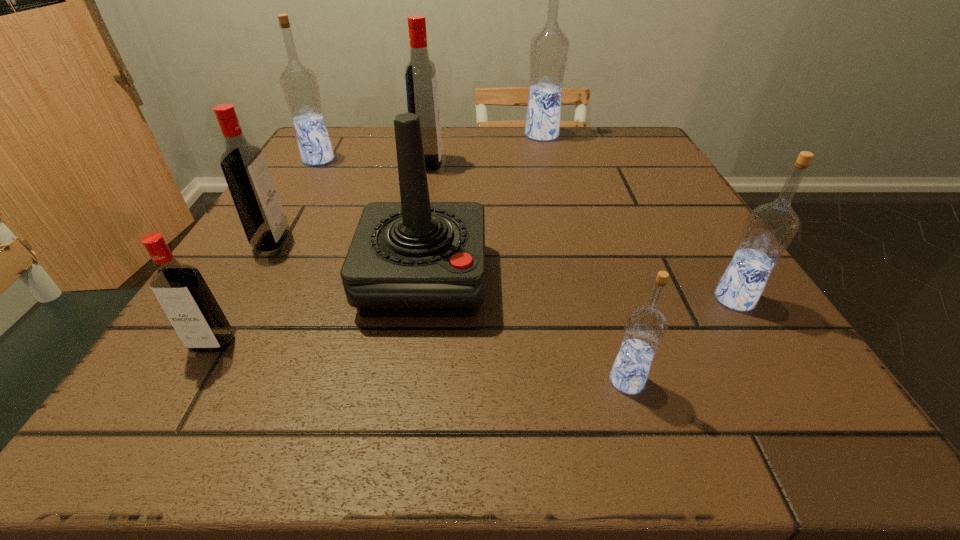
At what (x,y) coordinates should I click in order to perform the action: click on blue vodka object that ranks as the second closest to the nearest red vodka. Please return your answer as a coordinate pair (x, y). Image resolution: width=960 pixels, height=540 pixels. Looking at the image, I should click on (645, 327).

Choose which red vodka is the nearest neighbor to the smallest red vodka. Please provide its 2D coordinates. Your answer should be formatted as a tuple, i.e. [(x, y)], where the tuple contains the x and y coordinates of a point satisfying the conditions above.

[(257, 202)]

Image resolution: width=960 pixels, height=540 pixels. Find the location of `red vodka that is the second nearest to the second nearest vodka`. red vodka that is the second nearest to the second nearest vodka is located at coordinates [x=420, y=74].

You are a GUI agent. You are given a task and a screenshot of the screen. Output one action in this format:
    pyautogui.click(x=<x>, y=<y>)
    Task: Click on the free spot that satisfies the following two spatial constraints: 1. on the front and back of the fourth farthest vodka; 2. on the right side of the third nearest vodka
    The image size is (960, 540).
    Given the screenshot: What is the action you would take?
    pyautogui.click(x=237, y=299)

Where is `free location that satisfies the following two spatial constraints: 1. on the front and back of the nearest blue vodka; 2. on the left side of the farthest red vodka`? The height and width of the screenshot is (540, 960). free location that satisfies the following two spatial constraints: 1. on the front and back of the nearest blue vodka; 2. on the left side of the farthest red vodka is located at coordinates (387, 381).